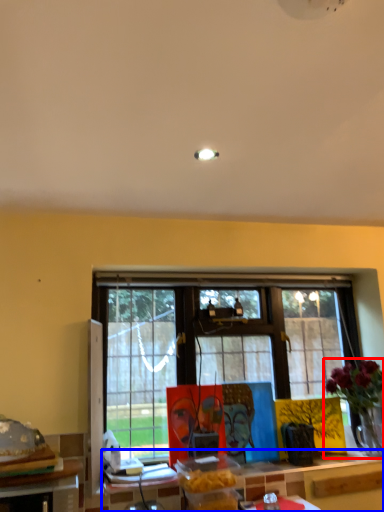
Question: Among these objects, which one is farthest to the camera, houseplant (highlighted by a red box) or table (highlighted by a blue box)?

Choices:
 (A) houseplant
 (B) table

Answer: (A)